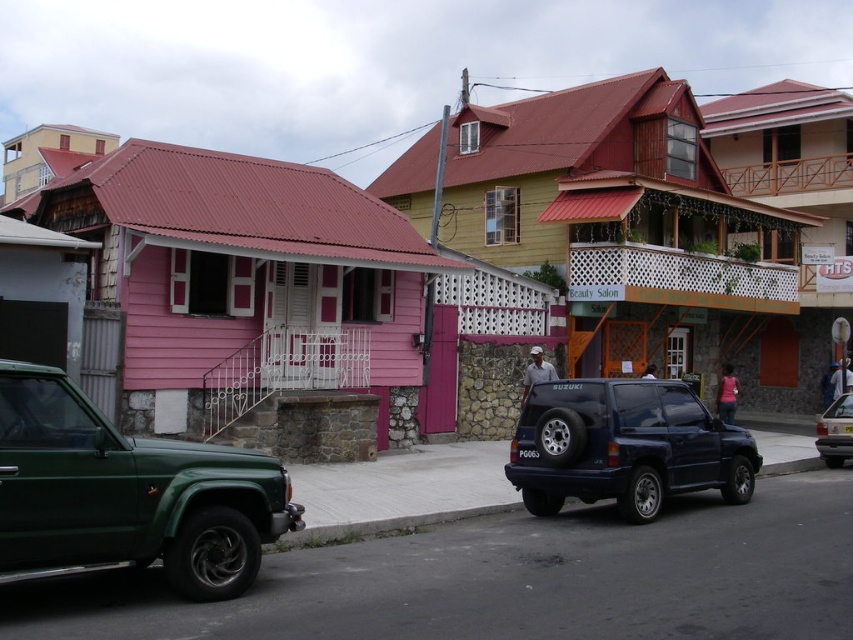
You are a delivery driver trying to park your shiny dark blue SUV at center in this street scene. Based on the parked cars and the layout, can you estimate if there is enough space between the dark green SUV on the left and the black Suzuki on the right for your vehicle?

The shiny dark blue SUV at center is located at point coordinates that suggest it is already parked between the dark green SUV on the left and the black Suzuki on the right. Since it is positioned there, there must be sufficient space for it to fit between those two vehicles.

You are a delivery driver who needs to park your vehicle in this area. You have a tall delivery van that is 2 meters in height. Looking at the green matte pickup truck at lower left and the metallic silver sedan at center, which vehicle demonstrates that there is enough clearance for your van to pass through?

The green matte pickup truck at lower left is much taller than the metallic silver sedan at center. Since your van is 2 meters tall, if the pickup truck can pass, then the sedan can also pass, but the clearance might be tight for the van. However, since the pickup truck is taller and it can fit, it indicates that the clearance is at least 2 meters, so your van should be able to pass through.